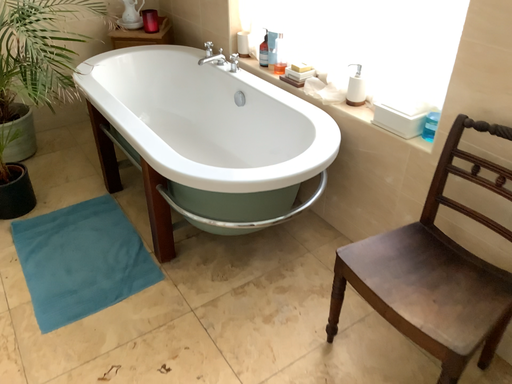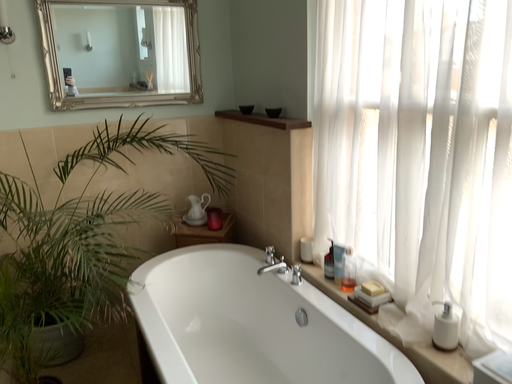
Question: How did the camera likely rotate when shooting the video?

Choices:
 (A) rotated upward
 (B) rotated downward

Answer: (A)